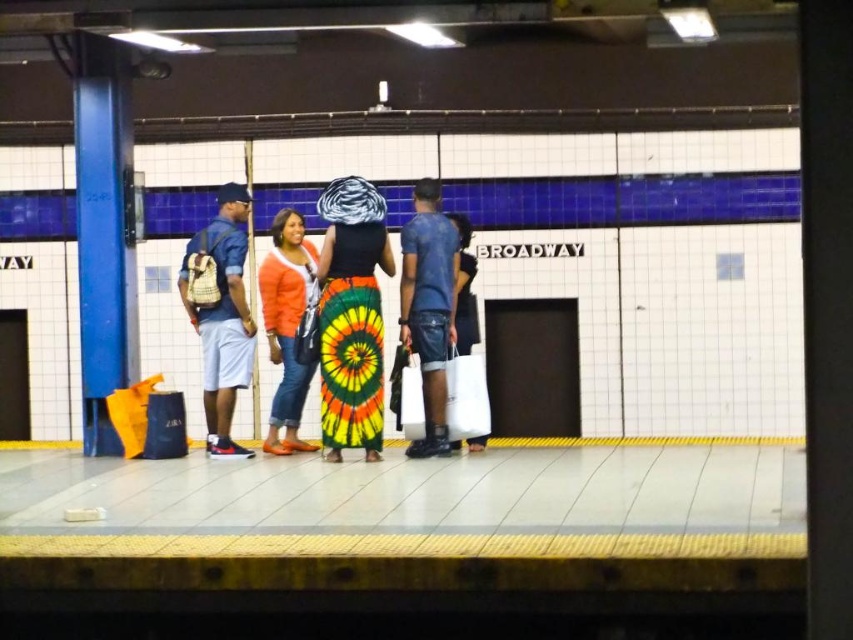
Can you confirm if denim shorts at left is shorter than denim shorts at center?

Yes, denim shorts at left is shorter than denim shorts at center.

Is denim shorts at left positioned before denim shorts at center?

No, it is behind denim shorts at center.

Between point (201, 282) and point (451, 252), which one is positioned behind?

Positioned behind is point (201, 282).

Find the location of a particular element. denim shorts at left is located at coordinates (221, 314).

Is denim shorts at center behind orange cotton sweater at center?

Yes, denim shorts at center is further from the viewer.

Is point (409, 266) farther from viewer compared to point (294, 420)?

No, (409, 266) is closer to viewer.

This screenshot has width=853, height=640. Identify the location of denim shorts at center. (428, 307).

Is the position of denim shorts at center more distant than that of white matte bag at center?

No.

Image resolution: width=853 pixels, height=640 pixels. I want to click on denim shorts at center, so click(428, 307).